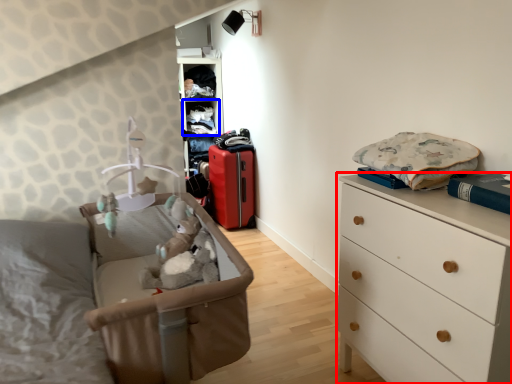
Question: Which point is closer to the camera, chest of drawers (highlighted by a red box) or shelf (highlighted by a blue box)?

Choices:
 (A) chest of drawers
 (B) shelf

Answer: (A)